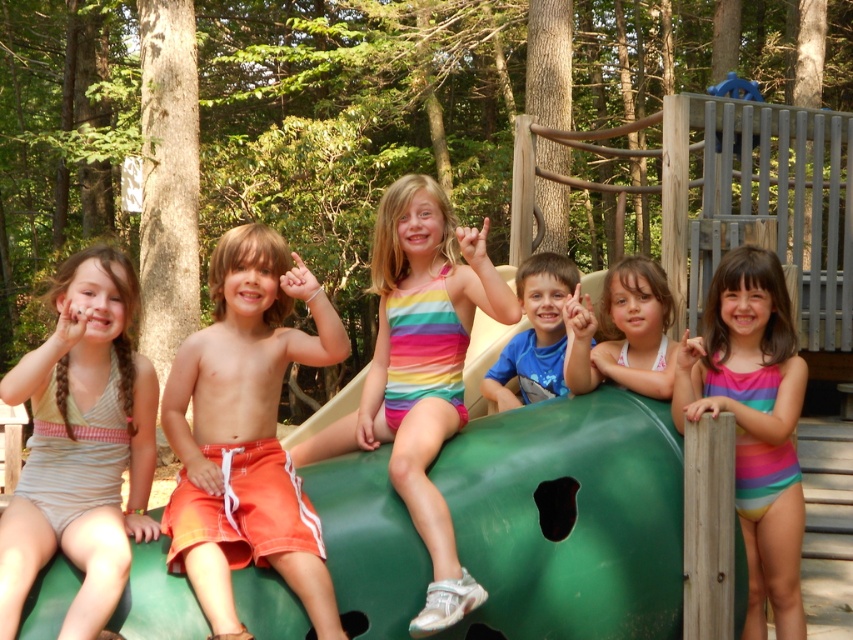
Question: Estimate the real-world distances between objects in this image. Which object is closer to the rainbow swimsuit at center?

Choices:
 (A) rainbow striped swimsuit at center
 (B) blue cotton shirt at center

Answer: (B)

Question: Among these points, which one is farthest from the camera?

Choices:
 (A) (293, 288)
 (B) (532, 282)
 (C) (718, 308)

Answer: (B)

Question: Does rainbow striped swimsuit at center have a greater width compared to pink striped swimsuit at center?

Choices:
 (A) no
 (B) yes

Answer: (B)

Question: Among these objects, which one is nearest to the camera?

Choices:
 (A) striped fabric swimsuit at left
 (B) blue cotton shirt at center
 (C) rainbow swimsuit at center

Answer: (A)

Question: Is rainbow striped swimsuit at center to the left of rainbow swimsuit at center from the viewer's perspective?

Choices:
 (A) no
 (B) yes

Answer: (B)

Question: Can you confirm if orange fabric shorts at center is wider than rainbow swimsuit at center?

Choices:
 (A) no
 (B) yes

Answer: (B)